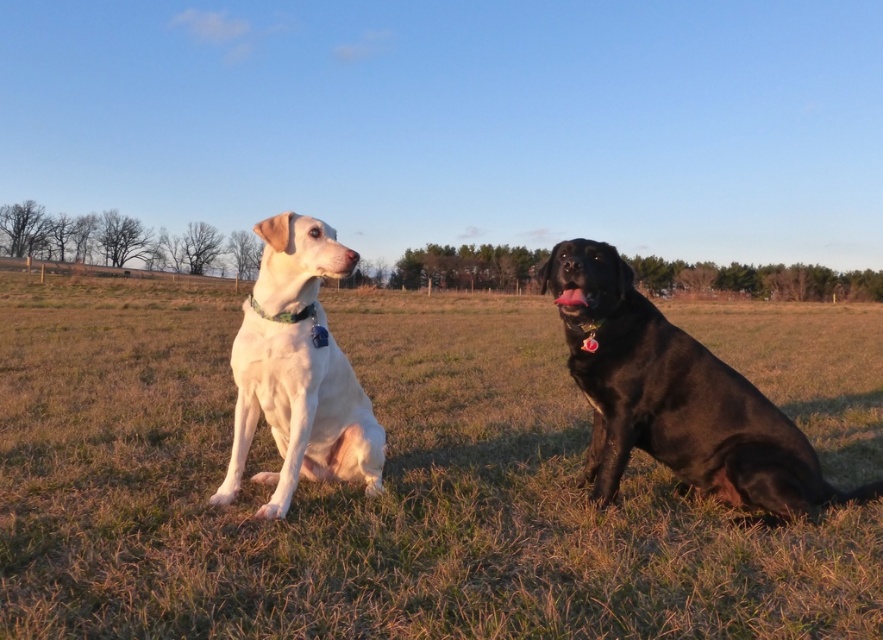
You are a dog trainer standing between the black glossy dog at right and the white matte dog at left. You need to give a treat to the closer dog. Which dog should you give the treat to?

The black glossy dog at right is 4.95 feet away from the white matte dog at left. Since you are standing between them, the closer dog would be whichever is nearest to your position. However, the distance between the two dogs is 4.95 feet, so without knowing your exact position between them, it is impossible to determine which is closer. Please clarify your position relative to both dogs.

You are standing at the origin point in the image and want to walk to the grassy field at center. Which direction should you move in terms of x and y coordinates?

The grassy field at center is located at coordinates x 0.769 and y 0.411, so you should move towards the right and slightly upwards since the x coordinate is higher than 0.5 and the y coordinate is above 0.4.